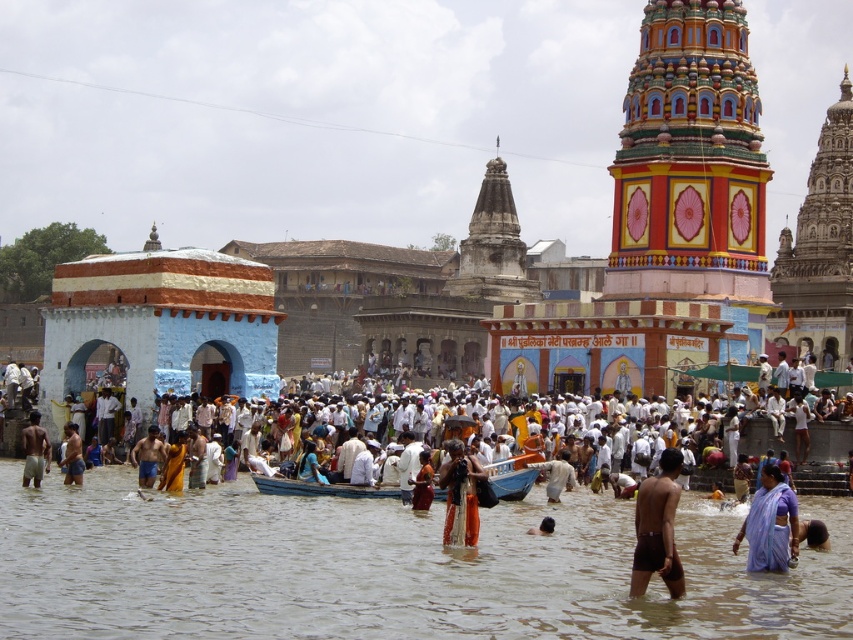
You are a photographer trying to capture a photo of the white clothed person at center without the brown muddy water at center appearing too large in the frame. Since the water is at the center, how should you adjust your camera angle to ensure the person is the main focus?

The brown muddy water at center is shorter than the white clothed person at center. To make the person the main focus, lower your camera angle so that the taller person is centered and the shorter water area becomes a smaller part of the frame.